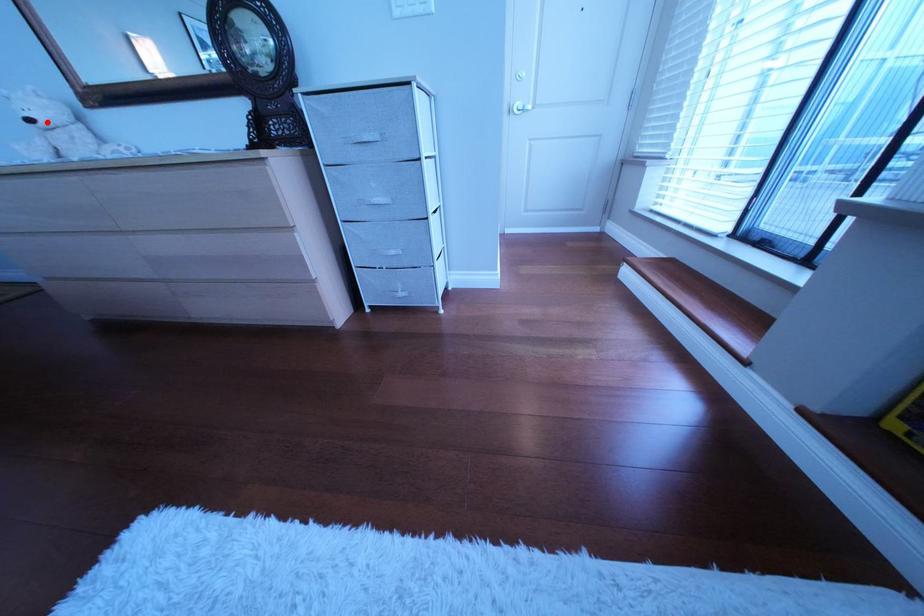
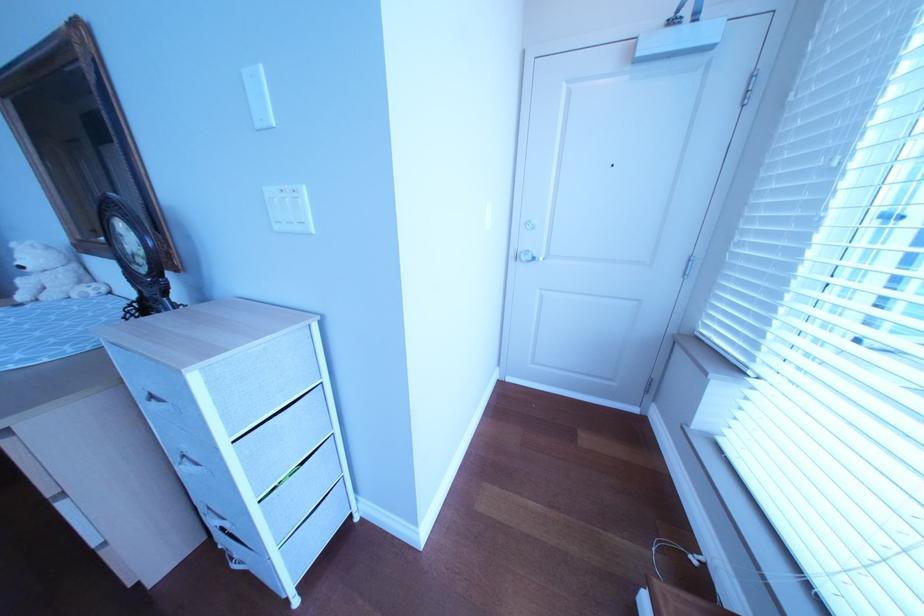
The point at the highlighted location is marked in the first image. Where is the corresponding point in the second image?

(37, 270)